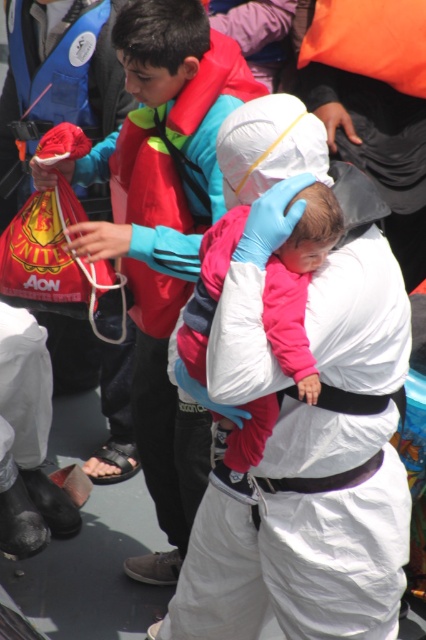
You are a safety inspector assessing the layout of this rescue operation. You notice the red nylon life jacket at upper center and the pink fleece jacket at center. Which of these items is positioned to the left of the other?

The red nylon life jacket at upper center is to the left of the pink fleece jacket at center.

You are a safety inspector assessing the gear in the image. The red nylon life jacket at upper center and the pink fleece jacket at center are both present. Which piece of clothing is taller?

The red nylon life jacket at upper center is taller than the pink fleece jacket at center.

You are a safety inspector reviewing the image of a rescue operation. You notice two jackets in the scene. The red nylon life jacket at upper center and the pink fleece jacket at center. Which jacket has a greater width?

The red nylon life jacket at upper center has a greater width than the pink fleece jacket at center according to the description.